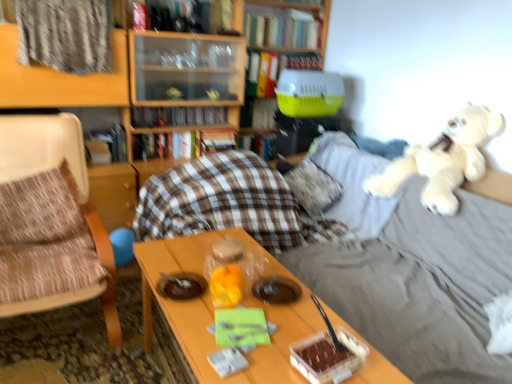
Question: Would you say plaid fabric at upper left is to the left or to the right of hardcover book at center, which ranks as the sixth book in bottom-to-top order, in the picture?

Choices:
 (A) left
 (B) right

Answer: (A)

Question: From a real-world perspective, is plaid fabric at upper left positioned above or below hardcover book at center, which ranks as the sixth book in bottom-to-top order?

Choices:
 (A) above
 (B) below

Answer: (A)

Question: Estimate the real-world distances between objects in this image. Which object is closer to the hardcover book at center, which is the 2th book from bottom to top?

Choices:
 (A) yellow plastic pet carrier at center
 (B) hardcover book at upper center, acting as the 1th book starting from the top
 (C) hardcover book at center, which is counted as the 8th book, starting from the top
 (D) plaid fabric at upper left
 (E) wooden bookcase at upper center

Answer: (C)

Question: Which is nearer to the fluffy white pillow at center?

Choices:
 (A) woven fabric chair at left
 (B) wooden bookcase at upper center
 (C) hardcover book at center, which ranks as the sixth book in bottom-to-top order
 (D) hardcover book at center, which is the 2th book from bottom to top
 (E) wooden table at center

Answer: (D)